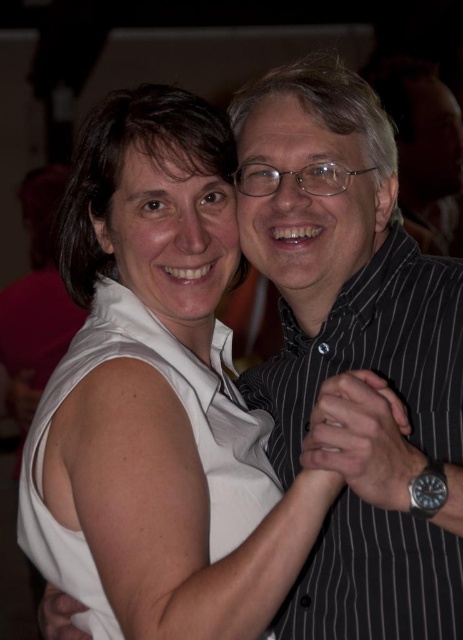
You are a photographer who wants to ensure both the black striped dress shirt at right and the white sleeveless dress at left are clearly visible in your photo. Since you can only focus on one subject at a time, which subject should you focus on to ensure the other remains somewhat in focus?

The black striped dress shirt at right is larger in size than the white sleeveless dress at left. To ensure both are somewhat in focus, focus on the subject wearing the black striped dress shirt at right since it is larger and might be easier to keep in focus while the smaller white sleeveless dress at left stays somewhat sharp due to the depth of field.

You are a photographer adjusting the focus of this image. The focus point is currently set at coordinates point (374,353). Which object in the scene will be in sharp focus?

The point (374,353) marks the black striped dress shirt at right, so the black striped dress shirt at right will be in sharp focus.

You are a photographer who wants to take a picture of the black striped dress shirt at right and the white sleeveless dress at left. Which one is positioned to the right side of the other?

The black striped dress shirt at right is positioned on the right side of white sleeveless dress at left.